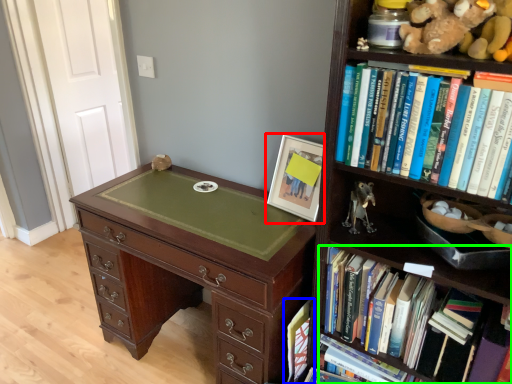
Question: Which object is positioned farthest from picture frame (highlighted by a red box)? Select from book (highlighted by a blue box) and book (highlighted by a green box).

Choices:
 (A) book
 (B) book

Answer: (A)